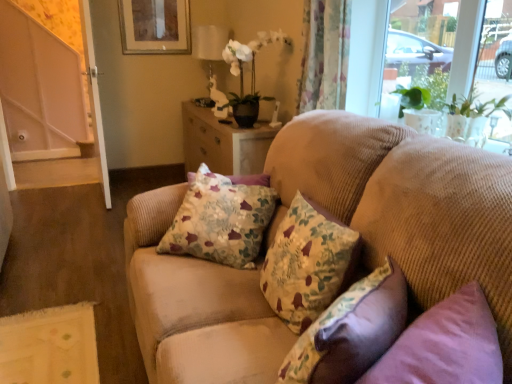
This screenshot has width=512, height=384. I want to click on floral fabric pillow at center, which is the 1th pillow in front-to-back order, so click(x=350, y=331).

Locate an element on the screen. The image size is (512, 384). white glossy door at left, placed as the 2th screen door when sorted from left to right is located at coordinates (95, 98).

In order to face white glossy door at left, placed as the 2th screen door when sorted from left to right, should I rotate leftwards or rightwards?

Turn left approximately 20.990 degrees to face it.

This screenshot has height=384, width=512. Identify the location of white glossy screen door at left, which ranks as the 1th screen door in left-to-right order. (39, 89).

Which is more distant, [247,337] or [335,258]?

The point [247,337] is farther from the camera.

Based on the photo, is beige corduroy couch at center beside floral fabric pillow at center, arranged as the 2th pillow when viewed from the front?

They are not placed beside each other.

From a real-world perspective, between beige corduroy couch at center and floral fabric pillow at center, arranged as the 2th pillow when viewed from the front, who is vertically lower?

From a 3D spatial view, beige corduroy couch at center is below.

Visually, is beige corduroy couch at center positioned to the left or to the right of floral fabric pillow at center, arranged as the 2th pillow when viewed from the front?

Based on their positions, beige corduroy couch at center is located to the left of floral fabric pillow at center, arranged as the 2th pillow when viewed from the front.

Is point (234, 40) positioned in front of point (182, 18)?

Yes, point (234, 40) is in front of point (182, 18).

From the image's perspective, which is above, white glossy orchid at upper center or matte wooden picture frame at upper center?

matte wooden picture frame at upper center, from the image's perspective.

Measure the distance from white glossy orchid at upper center to matte wooden picture frame at upper center.

white glossy orchid at upper center is 1.26 meters from matte wooden picture frame at upper center.

Consider the image. Is white glossy orchid at upper center not near matte wooden picture frame at upper center?

Yes, white glossy orchid at upper center is far from matte wooden picture frame at upper center.

Is beige corduroy couch at center positioned before floral fabric cushion at center, the first pillow positioned from the back?

Yes, it is in front of floral fabric cushion at center, the first pillow positioned from the back.

You are a GUI agent. You are given a task and a screenshot of the screen. Output one action in this format:
    pyautogui.click(x=<x>, y=<y>)
    Task: Click on the studio couch located underneath the floral fabric cushion at center, which is the third pillow from front to back (from a real-world perspective)
    The height and width of the screenshot is (384, 512).
    Given the screenshot: What is the action you would take?
    pyautogui.click(x=406, y=203)

Measure the distance from beige corduroy couch at center to floral fabric cushion at center, the first pillow positioned from the back.

beige corduroy couch at center is 9.65 inches from floral fabric cushion at center, the first pillow positioned from the back.

Is beige corduroy couch at center directly adjacent to floral fabric cushion at center, which is the third pillow from front to back?

No, beige corduroy couch at center is not with floral fabric cushion at center, which is the third pillow from front to back.

From the image's perspective, between beige corduroy couch at center and white glossy lampshade at upper center, which one is located above?

From the image's view, white glossy lampshade at upper center is above.

Is beige corduroy couch at center to the right of white glossy lampshade at upper center from the viewer's perspective?

Correct, you'll find beige corduroy couch at center to the right of white glossy lampshade at upper center.

Is beige corduroy couch at center outside of white glossy lampshade at upper center?

Indeed, beige corduroy couch at center is completely outside white glossy lampshade at upper center.

Considering the relative positions of white glossy door at left, placed as the 2th screen door when sorted from left to right, and beige corduroy couch at center in the image provided, is white glossy door at left, placed as the 2th screen door when sorted from left to right, to the left or to the right of beige corduroy couch at center?

white glossy door at left, placed as the 2th screen door when sorted from left to right, is positioned on beige corduroy couch at center's left side.

Between point (99, 126) and point (347, 179), which one is positioned behind?

The point (99, 126) is behind.

Consider the image. Is white glossy door at left, placed as the 2th screen door when sorted from left to right, oriented towards beige corduroy couch at center?

No, white glossy door at left, placed as the 2th screen door when sorted from left to right, does not turn towards beige corduroy couch at center.

Would you say white glossy door at left, placed as the 2th screen door when sorted from left to right, is inside or outside beige corduroy couch at center?

white glossy door at left, placed as the 2th screen door when sorted from left to right, is outside beige corduroy couch at center.

Is white glossy door at left, placed as the 2th screen door when sorted from left to right, behind floral fabric pillow at center, arranged as the 2th pillow when viewed from the front?

Yes, the depth of white glossy door at left, placed as the 2th screen door when sorted from left to right, is greater than that of floral fabric pillow at center, arranged as the 2th pillow when viewed from the front.

Considering the sizes of white glossy door at left, placed as the 2th screen door when sorted from left to right, and floral fabric pillow at center, arranged as the 2th pillow when viewed from the front, in the image, is white glossy door at left, placed as the 2th screen door when sorted from left to right, wider or thinner than floral fabric pillow at center, arranged as the 2th pillow when viewed from the front,?

white glossy door at left, placed as the 2th screen door when sorted from left to right, is thinner than floral fabric pillow at center, arranged as the 2th pillow when viewed from the front.

Does white glossy door at left, placed as the 2th screen door when sorted from left to right, appear on the left side of floral fabric pillow at center, the 2th pillow viewed from the back?

Yes.

Who is bigger, white glossy orchid at upper center or floral fabric cushion at center, which is the third pillow from front to back?

white glossy orchid at upper center is bigger.

Can you confirm if white glossy orchid at upper center is positioned to the left of floral fabric cushion at center, the first pillow positioned from the back?

No, white glossy orchid at upper center is not to the left of floral fabric cushion at center, the first pillow positioned from the back.

Looking at this image, can you confirm if white glossy orchid at upper center is taller than floral fabric cushion at center, the first pillow positioned from the back?

Indeed, white glossy orchid at upper center has a greater height compared to floral fabric cushion at center, the first pillow positioned from the back.

The width and height of the screenshot is (512, 384). In order to click on studio couch below the floral fabric pillow at center, the 2th pillow viewed from the back (from the image's perspective) in this screenshot , I will do `click(406, 203)`.

Find the location of a particular element. The height and width of the screenshot is (384, 512). houseplant in front of the matte wooden picture frame at upper center is located at coordinates (251, 73).

When comparing their distances from white glossy orchid at upper center, does floral fabric pillow at center, which is the 1th pillow in front-to-back order, or floral fabric cushion at center, the first pillow positioned from the back, seem closer?

floral fabric cushion at center, the first pillow positioned from the back, is positioned closer to the anchor white glossy orchid at upper center.

Considering their positions, is beige corduroy couch at center positioned further to white glossy door at left, which ranks as the 1th screen door in right-to-left order, than floral fabric pillow at center, which is the 1th pillow in front-to-back order?

Based on the image, floral fabric pillow at center, which is the 1th pillow in front-to-back order, appears to be further to white glossy door at left, which ranks as the 1th screen door in right-to-left order.

When comparing their distances from floral fabric pillow at center, arranged as the 2th pillow when viewed from the front, does white glossy door at left, which ranks as the 1th screen door in right-to-left order, or floral fabric pillow at center, which is the 1th pillow in front-to-back order, seem closer?

floral fabric pillow at center, which is the 1th pillow in front-to-back order, is closer to floral fabric pillow at center, arranged as the 2th pillow when viewed from the front.

Looking at the image, which one is located further to white glossy lampshade at upper center, floral fabric pillow at center, the third pillow viewed from the back, or floral fabric pillow at center, the 2th pillow viewed from the back?

floral fabric pillow at center, the third pillow viewed from the back, lies further to white glossy lampshade at upper center than the other object.

Looking at the image, which one is located closer to white glossy door at left, which ranks as the 1th screen door in right-to-left order, white glossy orchid at upper center or white glossy lampshade at upper center?

white glossy lampshade at upper center lies closer to white glossy door at left, which ranks as the 1th screen door in right-to-left order, than the other object.

Based on their spatial positions, is white glossy lampshade at upper center or white glossy door at left, placed as the 2th screen door when sorted from left to right, further from white glossy screen door at left, which is counted as the second screen door, starting from the right?

white glossy lampshade at upper center is further to white glossy screen door at left, which is counted as the second screen door, starting from the right.

From the image, which object appears to be nearer to floral fabric pillow at center, the 2th pillow viewed from the back, beige corduroy couch at center or white glossy lampshade at upper center?

beige corduroy couch at center is positioned closer to the anchor floral fabric pillow at center, the 2th pillow viewed from the back.

Based on their spatial positions, is white glossy lampshade at upper center or white glossy screen door at left, which is counted as the second screen door, starting from the right, closer to floral fabric pillow at center, which is the 1th pillow in front-to-back order?

white glossy lampshade at upper center lies closer to floral fabric pillow at center, which is the 1th pillow in front-to-back order, than the other object.

Where is `houseplant between floral fabric pillow at center, the third pillow viewed from the back, and white glossy lampshade at upper center in the front-back direction`? houseplant between floral fabric pillow at center, the third pillow viewed from the back, and white glossy lampshade at upper center in the front-back direction is located at coordinates (251, 73).

I want to click on picture frame between white glossy door at left, which ranks as the 1th screen door in right-to-left order, and white glossy lampshade at upper center, in the horizontal direction, so click(155, 26).

Image resolution: width=512 pixels, height=384 pixels. What are the coordinates of `houseplant located between beige corduroy couch at center and white glossy screen door at left, which ranks as the 1th screen door in left-to-right order, in the depth direction` in the screenshot? It's located at (251, 73).

Locate an element on the screen. picture frame between white glossy screen door at left, which is counted as the second screen door, starting from the right, and white glossy orchid at upper center from left to right is located at coordinates (155, 26).